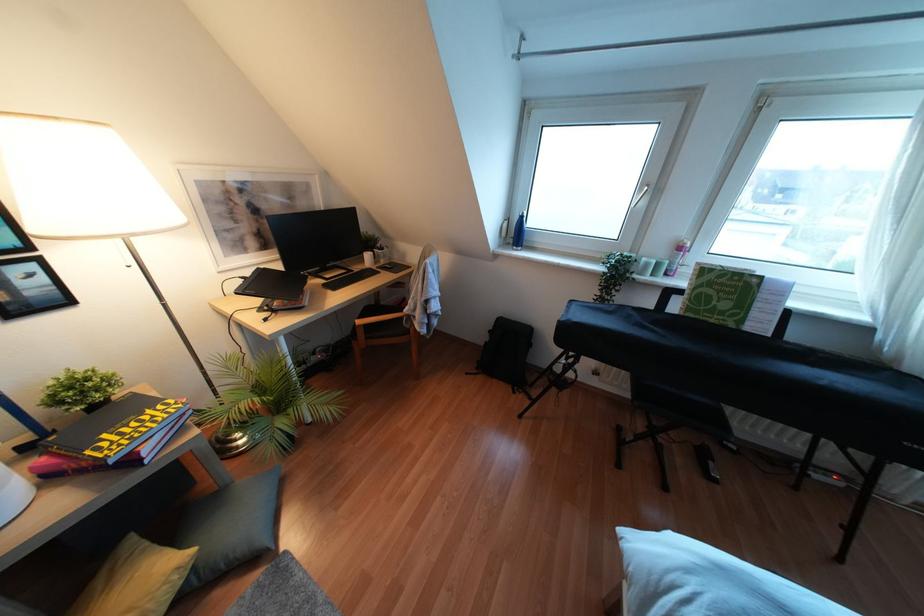
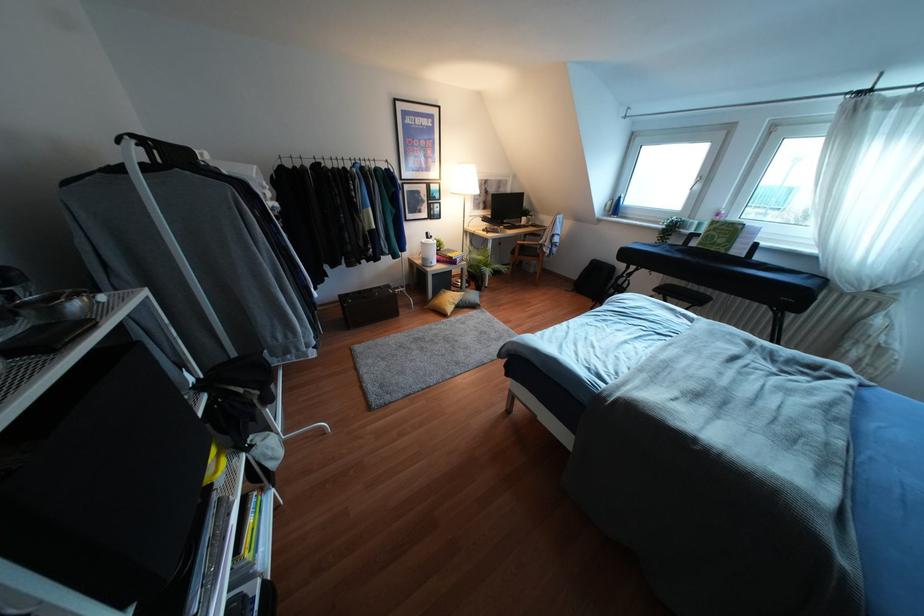
Locate, in the second image, the point that corresponds to point 708,296 in the first image.

(712, 236)